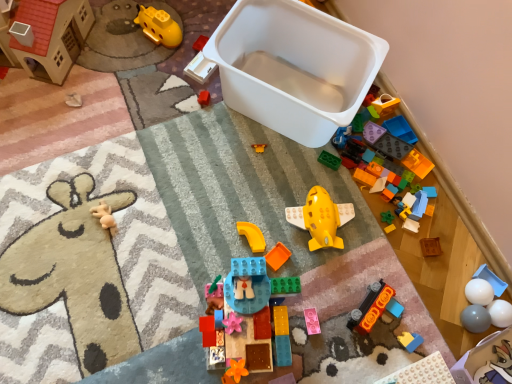
At what (x,y) coordinates should I click in order to perform the action: click on free area in between matte plastic toy at lower right, which is counted as the 12th toy, starting from the left, and orange matte block at center, acting as the 6th toy starting from the left. Please return your answer as a coordinate pair (x, y). Looking at the image, I should click on (338, 300).